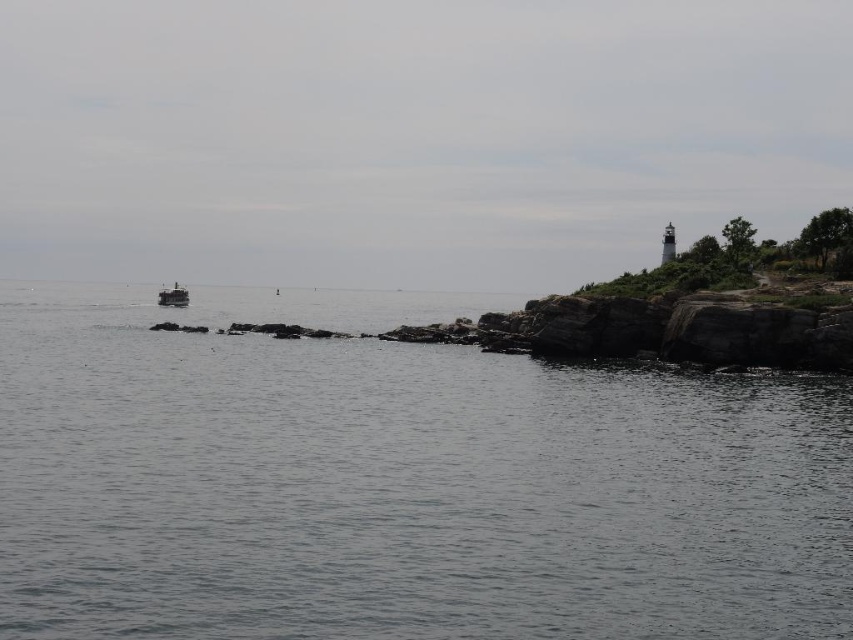
Question: Can you confirm if gray water at center is bigger than metallic gray boat at left?

Choices:
 (A) no
 (B) yes

Answer: (B)

Question: Which point appears farthest from the camera in this image?

Choices:
 (A) (164, 298)
 (B) (651, 417)

Answer: (A)

Question: Does gray water at center appear under metallic gray boat at left?

Choices:
 (A) no
 (B) yes

Answer: (B)

Question: Can you confirm if gray water at center is smaller than metallic gray boat at left?

Choices:
 (A) no
 (B) yes

Answer: (A)